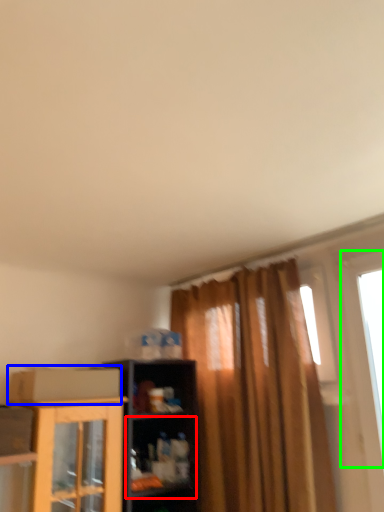
Question: Considering the real-world distances, which object is farthest from shelf (highlighted by a red box)? cardboard box (highlighted by a blue box) or window (highlighted by a green box)?

Choices:
 (A) cardboard box
 (B) window

Answer: (B)